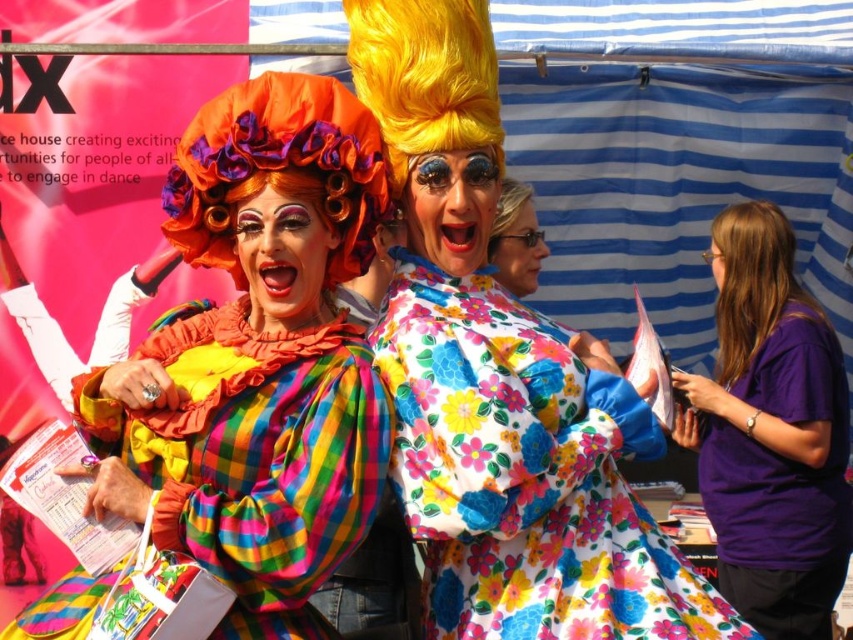
Question: Among these objects, which one is nearest to the camera?

Choices:
 (A) brown matte wig at right
 (B) floral fabric dress at center

Answer: (B)

Question: Does floral fabric dress at center lie behind brown matte wig at right?

Choices:
 (A) no
 (B) yes

Answer: (A)

Question: Can you confirm if floral fabric dress at center is positioned below fluffy yellow wig at center?

Choices:
 (A) yes
 (B) no

Answer: (A)

Question: Which point appears closest to the camera in this image?

Choices:
 (A) (271, 461)
 (B) (495, 236)
 (C) (445, 339)
 (D) (804, 472)

Answer: (A)

Question: Can you confirm if floral fabric dress at center is positioned to the left of fluffy yellow wig at center?

Choices:
 (A) yes
 (B) no

Answer: (B)

Question: Estimate the real-world distances between objects in this image. Which object is farther from the purple cotton t-shirt at right?

Choices:
 (A) floral fabric dress at center
 (B) multicolored plaid dress at center
 (C) fluffy yellow wig at center
 (D) brown matte wig at right

Answer: (B)